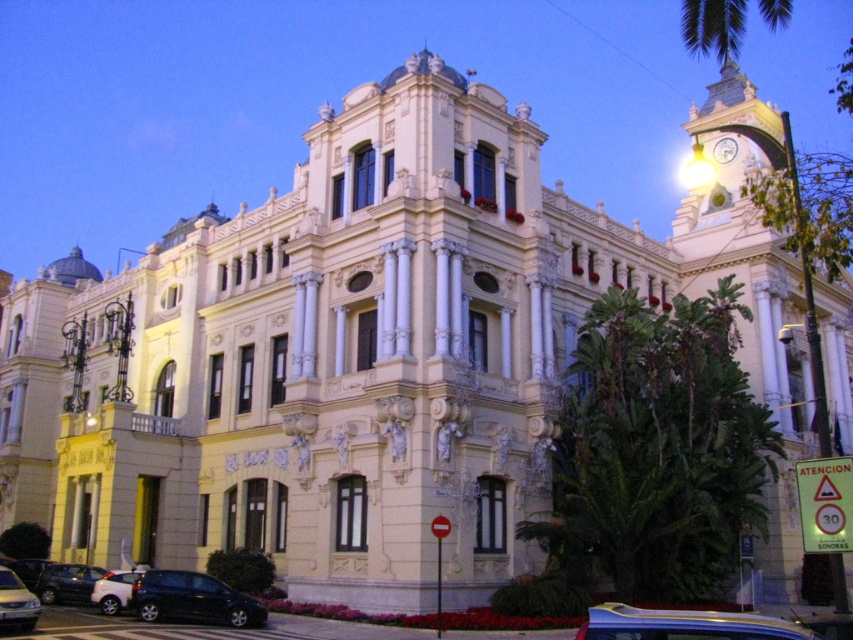
You are a photographer standing in front of the grand ornate building with its gold textured clock tower at upper right and white matte car at lower left. You want to capture a photo that emphasizes the height difference between these two objects. Which object should you focus on to highlight its vertical dominance?

The gold textured clock tower at upper right has a greater height compared to the white matte car at lower left, so focusing on the gold textured clock tower at upper right would best highlight its vertical dominance.

You are a photographer standing in front of the grand building. You want to capture a photo that includes both the gold textured clock tower at upper right and the metallic silver car at lower left. Based on their positions, which object should appear higher in your photo?

The gold textured clock tower at upper right should appear higher in the photo because it is positioned above the metallic silver car at lower left.

You are a photographer trying to capture the gold textured clock tower at upper right without any obstructions. You are standing near the white matte car at lower left. Can you take a clear photo of the clock tower from your current position?

The gold textured clock tower at upper right is in front of the white matte car at lower left, so you can take a clear photo of the gold textured clock tower at upper right from your current position near the white matte car at lower left without any obstruction.